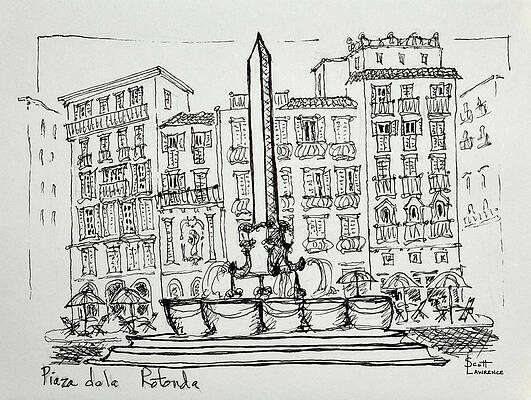
Where is `chairs`? This screenshot has width=531, height=400. chairs is located at coordinates (76, 325), (96, 326), (124, 325), (149, 325), (395, 308), (419, 310), (441, 312), (468, 313).